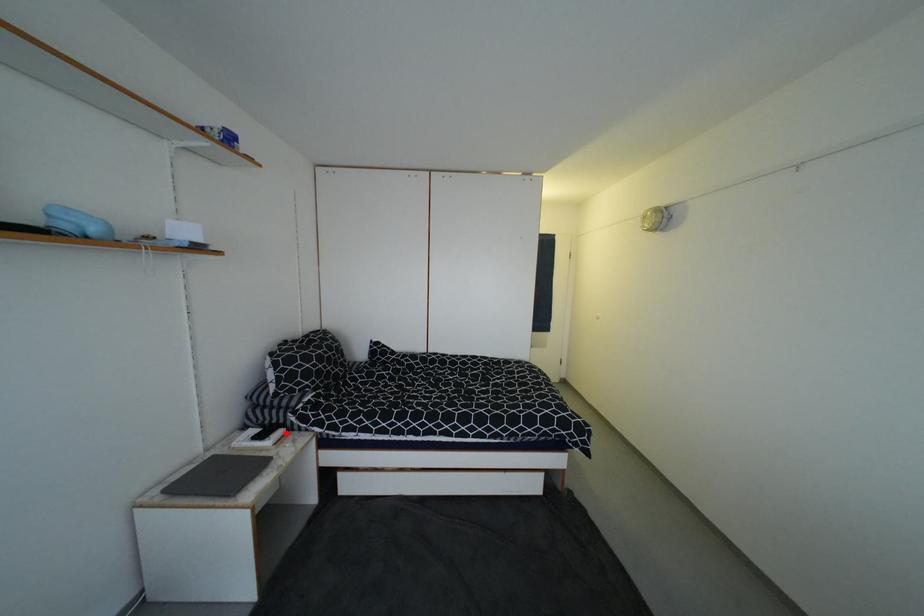
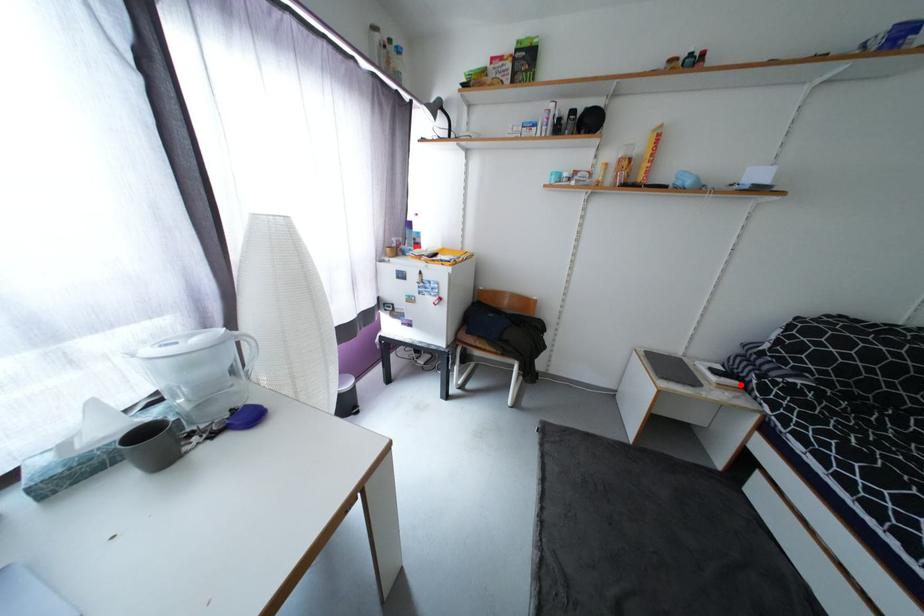
I am providing you with two images of the same scene from different viewpoints. A red point is marked on the first image and another point is marked on the second image. Is the red point in image1 aligned with the point shown in image2?

Yes